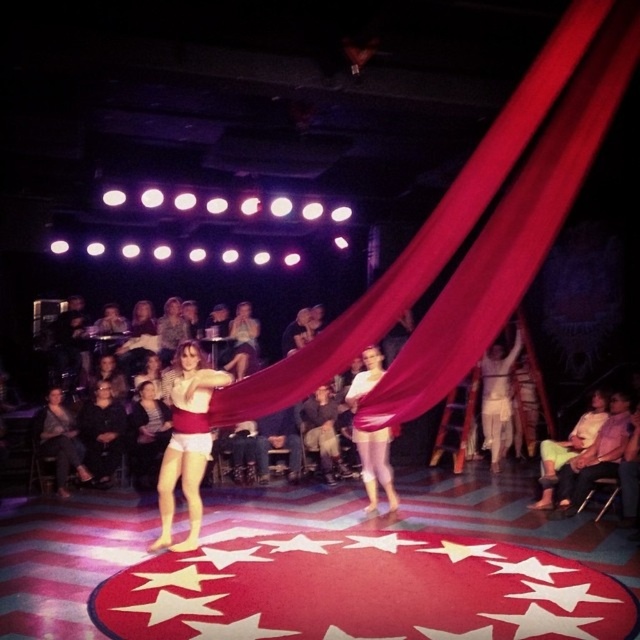
Question: Is the position of matte red shorts at center more distant than that of dark gray sweater at lower left?

Choices:
 (A) yes
 (B) no

Answer: (B)

Question: Which of the following is the closest to the observer?

Choices:
 (A) matte red shorts at center
 (B) dark gray sweater at lower left
 (C) dark gray fabric at center

Answer: (A)

Question: Which point appears closest to the camera in this image?

Choices:
 (A) (161, 506)
 (B) (323, 419)
 (C) (113, 458)

Answer: (A)

Question: Which point is closer to the camera?

Choices:
 (A) matte red shorts at center
 (B) dark gray fabric at center
 (C) dark gray sweater at lower left

Answer: (A)

Question: Considering the relative positions of matte red shorts at center and dark gray fabric at center in the image provided, where is matte red shorts at center located with respect to dark gray fabric at center?

Choices:
 (A) below
 (B) above

Answer: (B)

Question: Does matte red shorts at center have a smaller size compared to dark gray fabric at center?

Choices:
 (A) yes
 (B) no

Answer: (B)